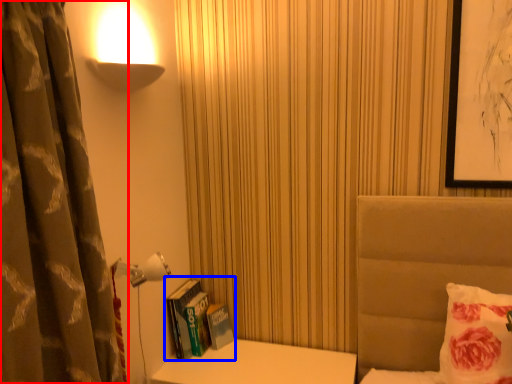
Question: Which point is further to the camera, curtain (highlighted by a red box) or book (highlighted by a blue box)?

Choices:
 (A) curtain
 (B) book

Answer: (B)